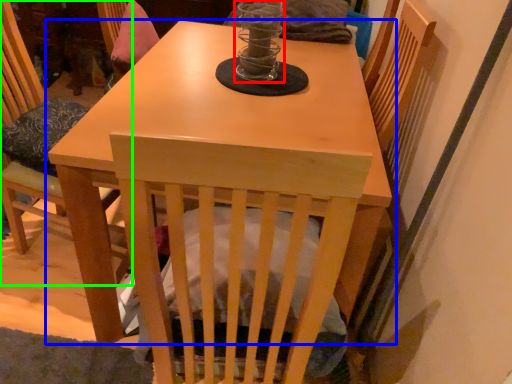
Question: Which object is the closest to the candle holder (highlighted by a red box)? Choose among these: table (highlighted by a blue box) or chair (highlighted by a green box).

Choices:
 (A) table
 (B) chair

Answer: (A)